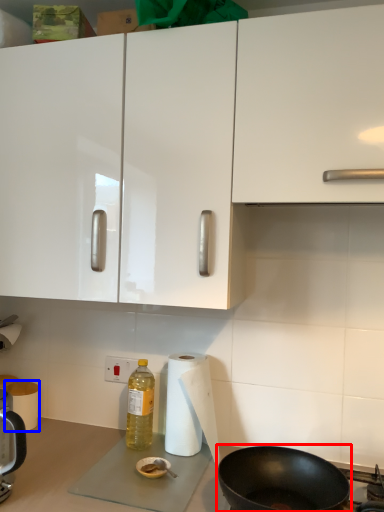
Question: Which object appears farthest to the camera in this image, frying pan (highlighted by a red box) or paper towel (highlighted by a blue box)?

Choices:
 (A) frying pan
 (B) paper towel

Answer: (B)